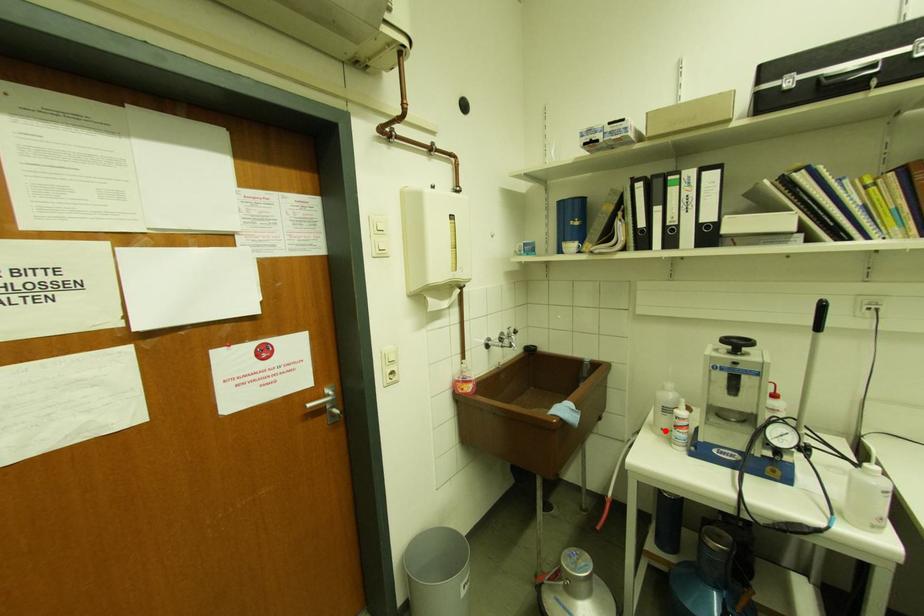
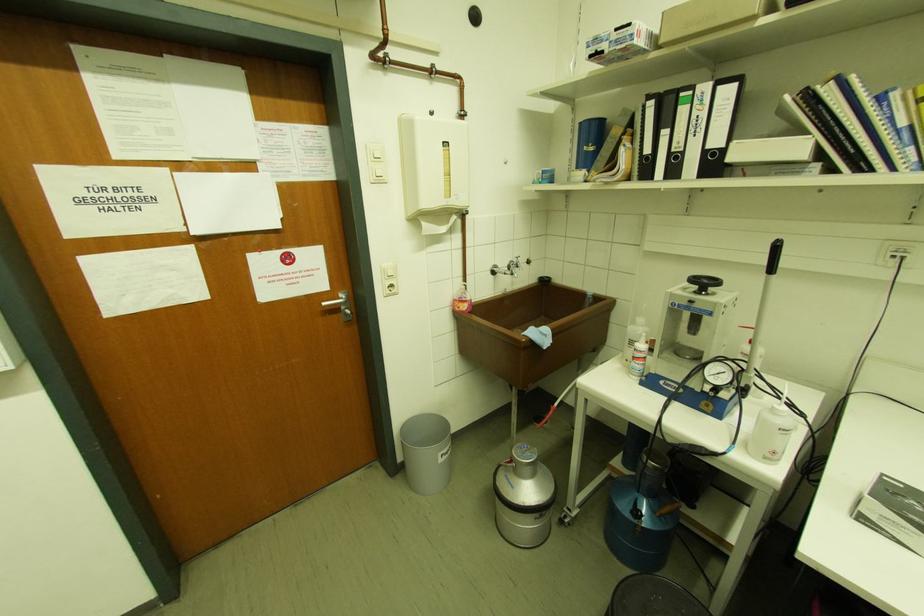
Question: I am providing you with two images of the same scene from different viewpoints. Image1 has a red point marked. In image2, the corresponding 3D location appears at what relative position? Reply with the corresponding letter.

Choices:
 (A) Closer
 (B) Farther

Answer: (A)